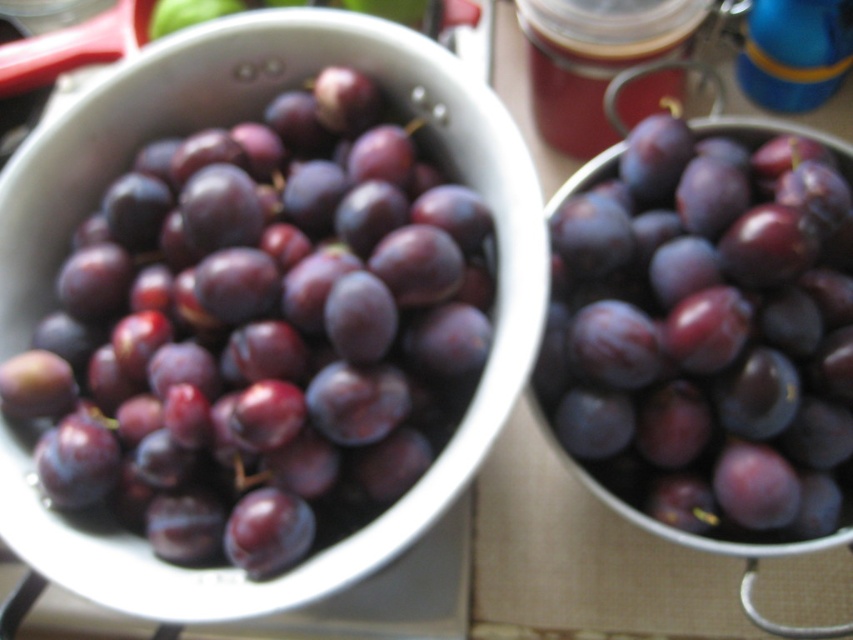
Does shiny purple grapes at left appear under shiny purple grapes at center?

Correct, shiny purple grapes at left is located below shiny purple grapes at center.

Is shiny purple grapes at left further to the viewer compared to shiny purple grapes at center?

No, shiny purple grapes at left is in front of shiny purple grapes at center.

Describe the element at coordinates (254, 333) in the screenshot. This screenshot has width=853, height=640. I see `shiny purple grapes at left` at that location.

Image resolution: width=853 pixels, height=640 pixels. I want to click on shiny purple grapes at left, so point(254,333).